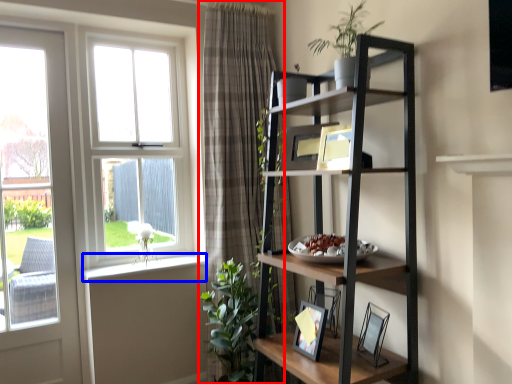
Question: Which object is closer to the camera taking this photo, curtain (highlighted by a red box) or window sill (highlighted by a blue box)?

Choices:
 (A) curtain
 (B) window sill

Answer: (A)